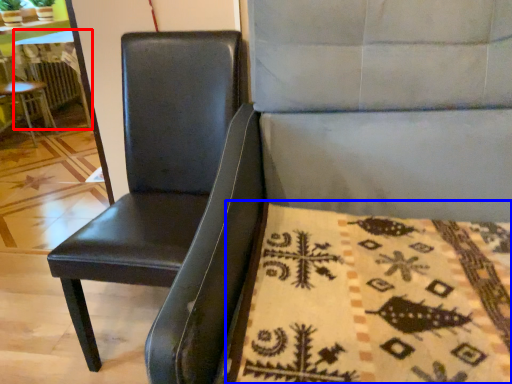
Question: Which object appears closest to the camera in this image, table (highlighted by a red box) or blanket (highlighted by a blue box)?

Choices:
 (A) table
 (B) blanket

Answer: (B)